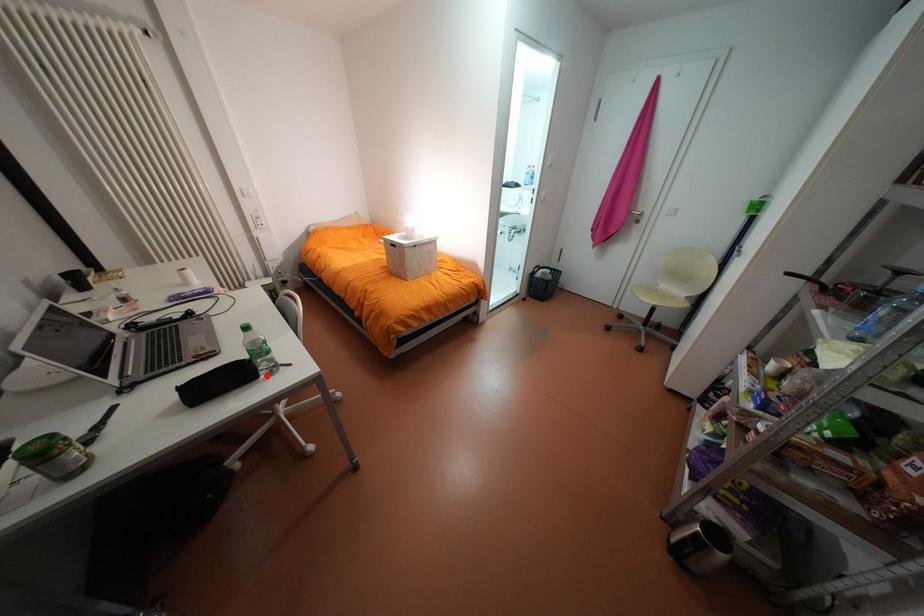
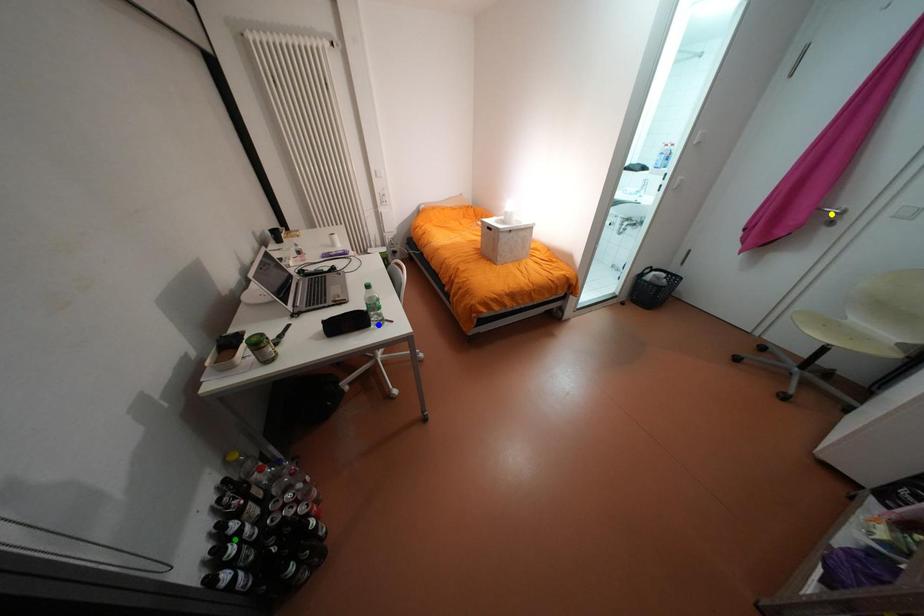
Question: I am providing you with two images of the same scene from different viewpoints. A red point is marked on the first image. You are given multiple points on the second image. Which point in image 2 is actually the same real-world point as the red point in image 1?

Choices:
 (A) blue point
 (B) yellow point
 (C) green point

Answer: (A)